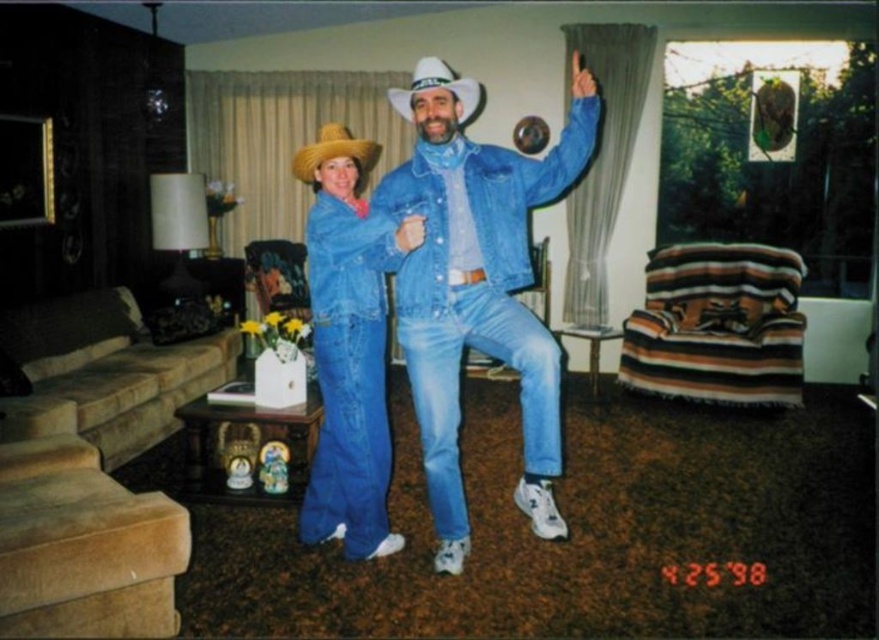
Question: Which point is closer to the camera?

Choices:
 (A) denim jacket at center
 (B) denim blue jeans at center
 (C) natural straw cowboy hat at center

Answer: (A)

Question: Is natural straw cowboy hat at center to the right of white denim cowboy hat at upper center from the viewer's perspective?

Choices:
 (A) no
 (B) yes

Answer: (A)

Question: Is denim jacket at center above white denim cowboy hat at upper center?

Choices:
 (A) no
 (B) yes

Answer: (A)

Question: Which object appears farthest from the camera in this image?

Choices:
 (A) denim jacket at center
 (B) denim blue jeans at center

Answer: (B)

Question: Among these points, which one is farthest from the camera?

Choices:
 (A) (456, 109)
 (B) (495, 349)
 (C) (354, 161)
 (D) (373, 282)

Answer: (D)

Question: Does denim blue jeans at center appear on the left side of denim jacket at center?

Choices:
 (A) no
 (B) yes

Answer: (A)